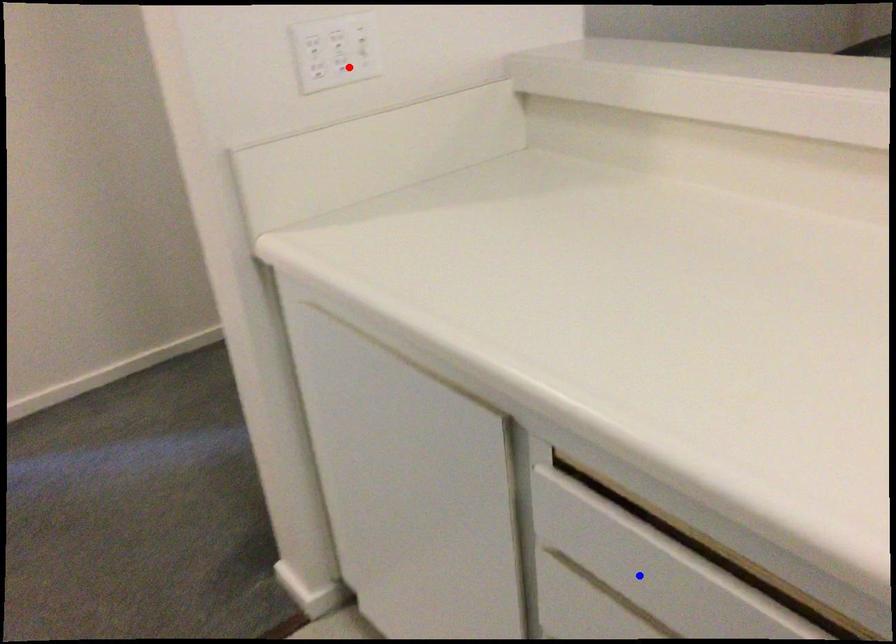
Question: Which of the two points in the image is closer to the camera?

Choices:
 (A) Blue point is closer.
 (B) Red point is closer.

Answer: (A)